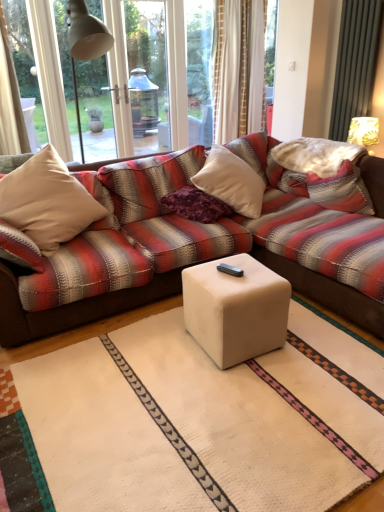
How much space does striped fabric pillow at right, marked as the first pillow in a right-to-left arrangement, occupy vertically?

striped fabric pillow at right, marked as the first pillow in a right-to-left arrangement, is 14.56 inches tall.

Where is `white matte cube at center`? This screenshot has height=512, width=384. white matte cube at center is located at coordinates (235, 309).

Consider the image. From the image's perspective, between purple textured pillow at center, the first pillow when ordered from left to right, and striped fabric pillow at right, positioned as the second pillow in left-to-right order, which one is located above?

striped fabric pillow at right, positioned as the second pillow in left-to-right order.

Is purple textured pillow at center, placed as the 2th pillow when sorted from right to left, taller or shorter than striped fabric pillow at right, positioned as the second pillow in left-to-right order?

Clearly, purple textured pillow at center, placed as the 2th pillow when sorted from right to left, is shorter compared to striped fabric pillow at right, positioned as the second pillow in left-to-right order.

Which of these two, purple textured pillow at center, placed as the 2th pillow when sorted from right to left, or striped fabric pillow at right, marked as the first pillow in a right-to-left arrangement, is thinner?

With smaller width is striped fabric pillow at right, marked as the first pillow in a right-to-left arrangement.

From a real-world perspective, between purple textured pillow at center, the first pillow when ordered from left to right, and striped fabric pillow at right, marked as the first pillow in a right-to-left arrangement, who is vertically higher?

striped fabric pillow at right, marked as the first pillow in a right-to-left arrangement, is physically above.

Considering the sizes of objects beige fabric pillow at left and white matte cube at center in the image provided, who is wider, beige fabric pillow at left or white matte cube at center?

With larger width is beige fabric pillow at left.

Considering the sizes of objects beige fabric pillow at left and white matte cube at center in the image provided, who is smaller, beige fabric pillow at left or white matte cube at center?

With smaller size is white matte cube at center.

Based on the photo, considering the sizes of objects beige fabric pillow at left and white matte cube at center in the image provided, who is shorter, beige fabric pillow at left or white matte cube at center?

Standing shorter between the two is white matte cube at center.

In the image, there is a beige fabric pillow at left. Where is `coffee table below it (from a real-world perspective)`? The height and width of the screenshot is (512, 384). coffee table below it (from a real-world perspective) is located at coordinates (235, 309).

Which of these two, striped fabric pillow at right, marked as the first pillow in a right-to-left arrangement, or white fabric lampshade at upper right, is wider?

With larger width is striped fabric pillow at right, marked as the first pillow in a right-to-left arrangement.

How many degrees apart are the facing directions of striped fabric pillow at right, marked as the first pillow in a right-to-left arrangement, and white fabric lampshade at upper right?

4.44 degrees.

From the image's perspective, would you say striped fabric pillow at right, positioned as the second pillow in left-to-right order, is shown under white fabric lampshade at upper right?

Yes, from the image's perspective, striped fabric pillow at right, positioned as the second pillow in left-to-right order, is beneath white fabric lampshade at upper right.

Is striped fabric pillow at right, positioned as the second pillow in left-to-right order, not close to white fabric lampshade at upper right?

That's not correct — striped fabric pillow at right, positioned as the second pillow in left-to-right order, is a little close to white fabric lampshade at upper right.

Are beige fabric pillow at left and white fabric lampshade at upper right far apart?

Indeed, beige fabric pillow at left is not near white fabric lampshade at upper right.

Is beige fabric pillow at left inside or outside of white fabric lampshade at upper right?

beige fabric pillow at left is located beyond the bounds of white fabric lampshade at upper right.

Is beige fabric pillow at left smaller than white fabric lampshade at upper right?

No, beige fabric pillow at left is not smaller than white fabric lampshade at upper right.

Relative to white fabric lampshade at upper right, is beige fabric pillow at left in front or behind?

Clearly, beige fabric pillow at left is in front of white fabric lampshade at upper right.

Does purple textured pillow at center, the first pillow when ordered from left to right, have a smaller size compared to white matte cube at center?

Yes.

From their relative heights in the image, would you say purple textured pillow at center, placed as the 2th pillow when sorted from right to left, is taller or shorter than white matte cube at center?

In the image, purple textured pillow at center, placed as the 2th pillow when sorted from right to left, appears to be shorter than white matte cube at center.

In the scene shown: Considering the relative sizes of purple textured pillow at center, the first pillow when ordered from left to right, and white matte cube at center in the image provided, is purple textured pillow at center, the first pillow when ordered from left to right, thinner than white matte cube at center?

In fact, purple textured pillow at center, the first pillow when ordered from left to right, might be wider than white matte cube at center.

Considering the positions of point (328, 207) and point (82, 191), is point (328, 207) closer or farther from the camera than point (82, 191)?

Point (328, 207) is positioned farther from the camera compared to point (82, 191).

Which object is closer to the camera taking this photo, striped fabric pillow at right, marked as the first pillow in a right-to-left arrangement, or beige fabric pillow at left?

beige fabric pillow at left is more forward.

In the image, is striped fabric pillow at right, positioned as the second pillow in left-to-right order, on the left side or the right side of beige fabric pillow at left?

Clearly, striped fabric pillow at right, positioned as the second pillow in left-to-right order, is on the right of beige fabric pillow at left in the image.

Is the surface of striped fabric pillow at right, positioned as the second pillow in left-to-right order, in direct contact with beige fabric pillow at left?

They are not placed beside each other.

Considering the sizes of objects white matte cube at center and beige fabric pillow at left in the image provided, who is wider, white matte cube at center or beige fabric pillow at left?

Wider between the two is beige fabric pillow at left.

From a real-world perspective, is white matte cube at center located higher than beige fabric pillow at left?

No, from a real-world perspective, white matte cube at center is not over beige fabric pillow at left

Identify the location of coffee table in front of the beige fabric pillow at left. Image resolution: width=384 pixels, height=512 pixels. (235, 309).

Based on their positions, is white matte cube at center located to the left or right of beige fabric pillow at left?

From the image, it's evident that white matte cube at center is to the right of beige fabric pillow at left.

In order to click on pillow to the left of striped fabric pillow at right, marked as the first pillow in a right-to-left arrangement in this screenshot , I will do `click(195, 205)`.

In the image, there is a white matte cube at center. Where is `throw pillow above it (from the image's perspective)`? This screenshot has height=512, width=384. throw pillow above it (from the image's perspective) is located at coordinates (47, 201).

Considering their positions, is white matte cube at center positioned further to striped fabric pillow at right, marked as the first pillow in a right-to-left arrangement, than white fabric lampshade at upper right?

white matte cube at center is further to striped fabric pillow at right, marked as the first pillow in a right-to-left arrangement.

From the picture: Estimate the real-world distances between objects in this image. Which object is closer to white fabric lampshade at upper right, striped fabric pillow at right, marked as the first pillow in a right-to-left arrangement, or white matte cube at center?

Based on the image, striped fabric pillow at right, marked as the first pillow in a right-to-left arrangement, appears to be nearer to white fabric lampshade at upper right.

From the image, which object appears to be farther from white fabric lampshade at upper right, beige fabric pillow at left or white matte cube at center?

Among the two, beige fabric pillow at left is located further to white fabric lampshade at upper right.

Based on their spatial positions, is purple textured pillow at center, placed as the 2th pillow when sorted from right to left, or white fabric lampshade at upper right closer to beige fabric pillow at left?

Among the two, purple textured pillow at center, placed as the 2th pillow when sorted from right to left, is located nearer to beige fabric pillow at left.

When comparing their distances from white matte cube at center, does white fabric lampshade at upper right or striped fabric pillow at right, positioned as the second pillow in left-to-right order, seem closer?

striped fabric pillow at right, positioned as the second pillow in left-to-right order, lies closer to white matte cube at center than the other object.

Considering their positions, is striped fabric pillow at right, marked as the first pillow in a right-to-left arrangement, positioned closer to white matte cube at center than beige fabric pillow at left?

Among the two, beige fabric pillow at left is located nearer to white matte cube at center.

Which object lies further to the anchor point white fabric lampshade at upper right, purple textured pillow at center, placed as the 2th pillow when sorted from right to left, or white matte cube at center?

Among the two, white matte cube at center is located further to white fabric lampshade at upper right.

From the image, which object appears to be nearer to beige fabric pillow at left, white matte cube at center or white fabric lampshade at upper right?

white matte cube at center is positioned closer to the anchor beige fabric pillow at left.

This screenshot has width=384, height=512. I want to click on coffee table between beige fabric pillow at left and striped fabric pillow at right, positioned as the second pillow in left-to-right order, in the horizontal direction, so click(x=235, y=309).

Identify the location of pillow between beige fabric pillow at left and striped fabric pillow at right, marked as the first pillow in a right-to-left arrangement, in the horizontal direction. (195, 205).

In order to click on pillow located between purple textured pillow at center, placed as the 2th pillow when sorted from right to left, and white fabric lampshade at upper right in the left-right direction in this screenshot , I will do `click(341, 190)`.

What are the coordinates of `coffee table between purple textured pillow at center, placed as the 2th pillow when sorted from right to left, and striped fabric pillow at right, positioned as the second pillow in left-to-right order` in the screenshot? It's located at (235, 309).